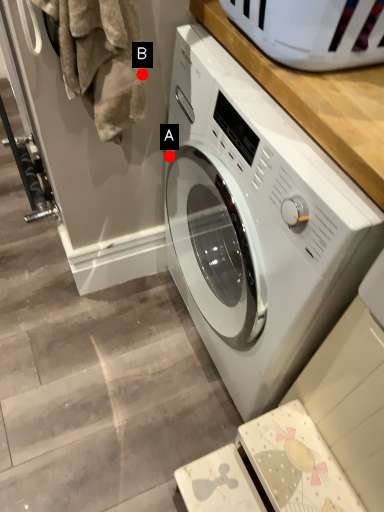
Question: Two points are circled on the image, labeled by A and B beside each circle. Which point is farther to the camera?

Choices:
 (A) A is further
 (B) B is further

Answer: (A)